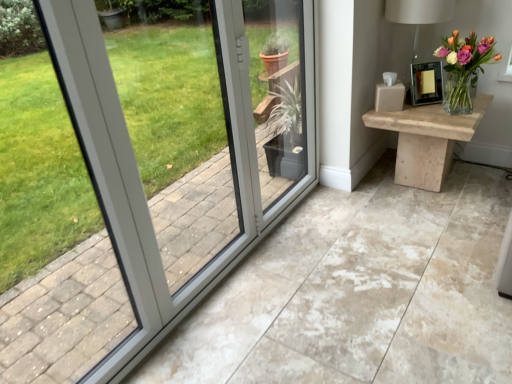
Question: Can you confirm if natural wood table at right is thinner than matte white table lamp at upper right?

Choices:
 (A) no
 (B) yes

Answer: (A)

Question: Is natural wood table at right aimed at matte white table lamp at upper right?

Choices:
 (A) no
 (B) yes

Answer: (A)

Question: From the image's perspective, is natural wood table at right beneath matte white table lamp at upper right?

Choices:
 (A) no
 (B) yes

Answer: (B)

Question: Is natural wood table at right at the left side of matte white table lamp at upper right?

Choices:
 (A) yes
 (B) no

Answer: (B)

Question: Can you confirm if natural wood table at right is positioned to the right of matte white table lamp at upper right?

Choices:
 (A) no
 (B) yes

Answer: (B)

Question: Is there a large distance between natural wood table at right and matte white table lamp at upper right?

Choices:
 (A) no
 (B) yes

Answer: (A)

Question: From a real-world perspective, is matte white table lamp at upper right physically below clear glass vase at upper right?

Choices:
 (A) yes
 (B) no

Answer: (B)

Question: Does matte white table lamp at upper right have a smaller size compared to clear glass vase at upper right?

Choices:
 (A) yes
 (B) no

Answer: (B)

Question: From a real-world perspective, is matte white table lamp at upper right physically above clear glass vase at upper right?

Choices:
 (A) no
 (B) yes

Answer: (B)

Question: Can you confirm if matte white table lamp at upper right is taller than clear glass vase at upper right?

Choices:
 (A) no
 (B) yes

Answer: (B)

Question: Would you consider matte white table lamp at upper right to be distant from clear glass vase at upper right?

Choices:
 (A) yes
 (B) no

Answer: (B)

Question: Is matte white table lamp at upper right positioned with its back to clear glass vase at upper right?

Choices:
 (A) yes
 (B) no

Answer: (B)

Question: Is natural wood table at right positioned behind clear glass vase at upper right?

Choices:
 (A) yes
 (B) no

Answer: (A)